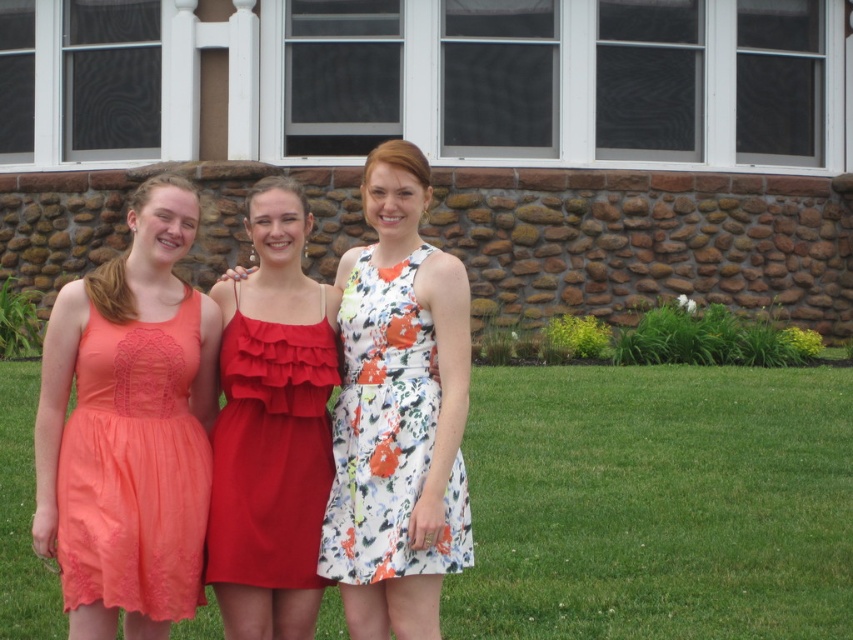
Question: Which object is farther from the camera taking this photo?

Choices:
 (A) coral lace dress at left
 (B) floral printed fabric dress at center
 (C) floral fabric dress at center

Answer: (B)

Question: Which point is closer to the camera taking this photo?

Choices:
 (A) (347, 573)
 (B) (405, 285)
 (C) (323, 476)
 (D) (558, 426)

Answer: (A)

Question: Which point appears closest to the camera in this image?

Choices:
 (A) (844, 525)
 (B) (367, 536)
 (C) (395, 525)

Answer: (C)

Question: Is floral printed fabric dress at center positioned in front of red satin dress at center?

Choices:
 (A) no
 (B) yes

Answer: (B)

Question: Can you confirm if floral fabric dress at center is positioned to the right of coral lace dress at left?

Choices:
 (A) yes
 (B) no

Answer: (A)

Question: Can you confirm if coral lace dress at left is thinner than floral printed fabric dress at center?

Choices:
 (A) yes
 (B) no

Answer: (A)